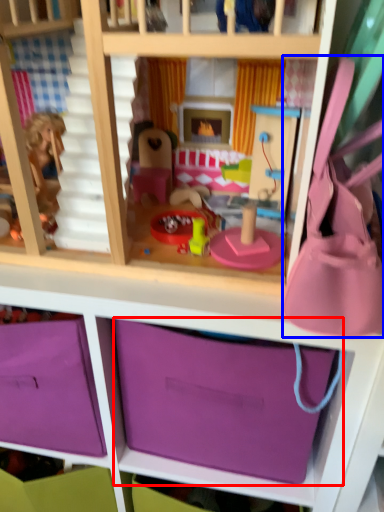
Question: Which of the following is the farthest to the observer, storage box (highlighted by a red box) or accessory (highlighted by a blue box)?

Choices:
 (A) storage box
 (B) accessory

Answer: (A)